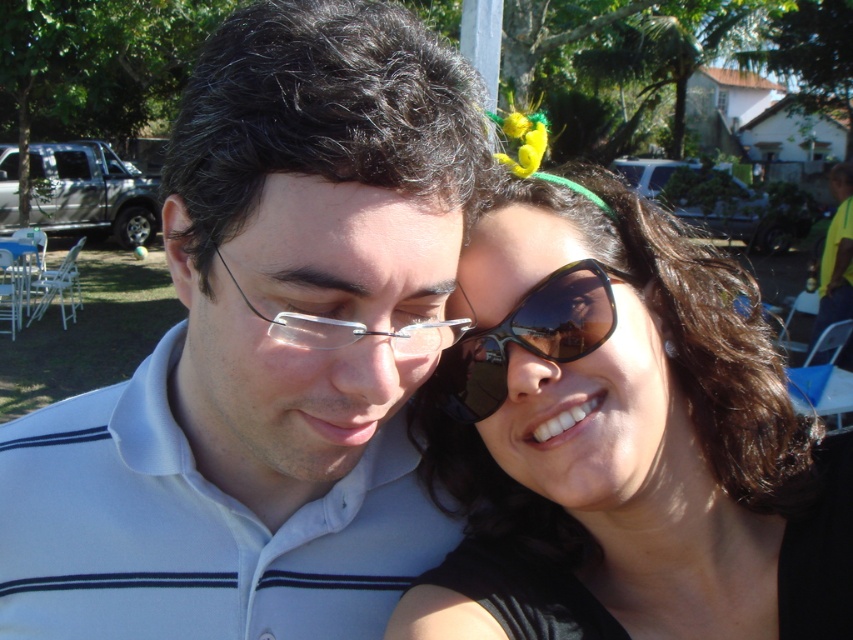
Question: Based on their relative distances, which object is nearer to the sunglasses at upper right?

Choices:
 (A) black reflective sunglasses at center
 (B) white matte shirt at center

Answer: (A)

Question: Does sunglasses at upper right lie behind clear plastic glasses at center?

Choices:
 (A) no
 (B) yes

Answer: (B)

Question: Considering the relative positions of white matte shirt at center and clear plastic glasses at center in the image provided, where is white matte shirt at center located with respect to clear plastic glasses at center?

Choices:
 (A) right
 (B) left

Answer: (B)

Question: Which point is farther to the camera?

Choices:
 (A) (421, 228)
 (B) (453, 451)
 (C) (532, 352)
 (D) (281, 326)

Answer: (B)

Question: In this image, where is white matte shirt at center located relative to black reflective sunglasses at center?

Choices:
 (A) right
 (B) left

Answer: (B)

Question: Among these objects, which one is farthest from the camera?

Choices:
 (A) clear plastic glasses at center
 (B) white matte shirt at center

Answer: (A)